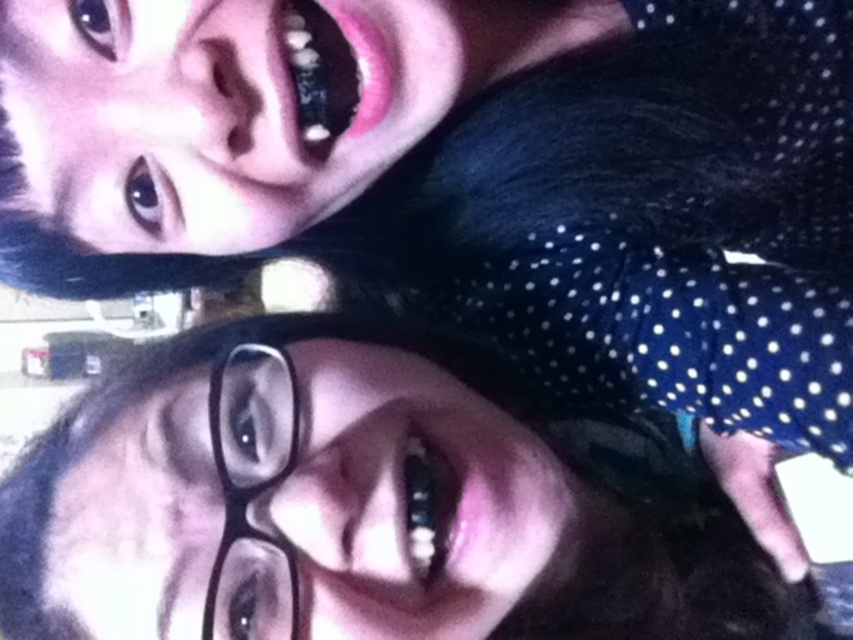
What do you see at coordinates (367, 502) in the screenshot? I see `black matte glasses at center` at bounding box center [367, 502].

Can you confirm if black matte glasses at center is positioned above black plastic glasses at lower left?

No, black matte glasses at center is not above black plastic glasses at lower left.

Is point (160, 451) behind point (273, 460)?

Yes, it is behind point (273, 460).

This screenshot has height=640, width=853. In order to click on black matte glasses at center in this screenshot , I will do `click(367, 502)`.